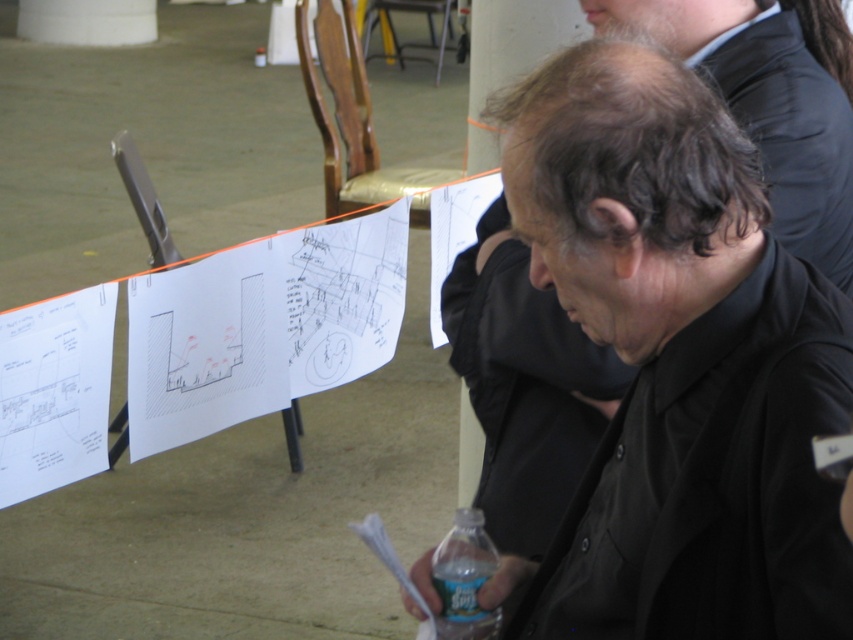
You are a photographer standing at a distance of 1.1 meters from the subject. You want to take a closeup photo of the black matte shirt at center. Based on the description, will the subject be in focus if you focus at 1.1 meters?

The black matte shirt at center is 1.19 meters from the camera. Since the focus distance is set at 1.1 meters, the subject is slightly farther away than the focus point. This means the subject may not be in sharp focus. To ensure clarity, adjust the focus to 1.19 meters or move closer by 0.09 meters.

You are a tailor measuring the distance between the black matte shirt at center and the black matte jacket at lower right. Can you fit a 1 inch wide ribbon between them?

The black matte shirt at center is 0.99 inches away from the black matte jacket at lower right, so the 1 inch wide ribbon cannot fit between them since the space is slightly smaller.